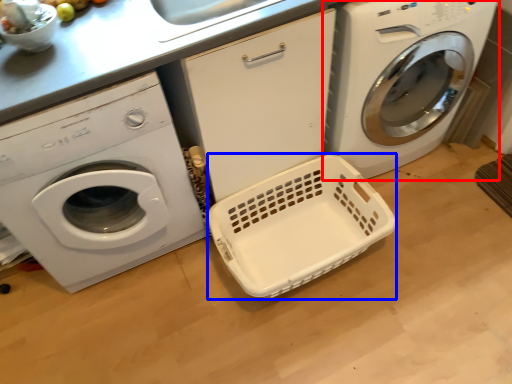
Question: Which point is further to the camera, washing machine (highlighted by a red box) or basket container (highlighted by a blue box)?

Choices:
 (A) washing machine
 (B) basket container

Answer: (B)